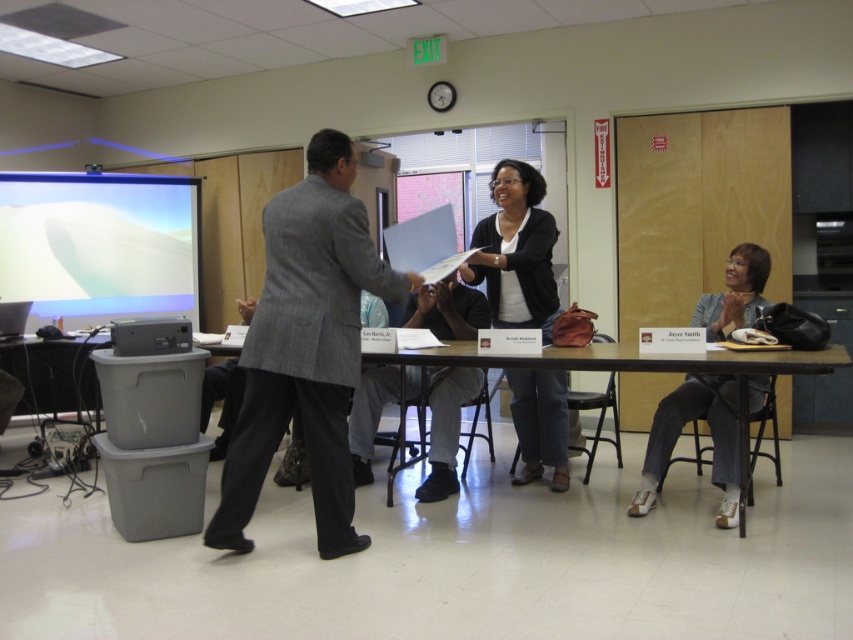
Can you confirm if gray textured suit at center is wider than matte black sweater at center?

Correct, the width of gray textured suit at center exceeds that of matte black sweater at center.

Which is below, gray textured suit at center or matte black sweater at center?

gray textured suit at center is below.

Who is more distant from viewer, [323,333] or [519,474]?

Point [519,474]

The width and height of the screenshot is (853, 640). I want to click on gray textured suit at center, so click(x=306, y=348).

Can you confirm if gray textured suit at center is wider than white matte projection screen at upper left?

Incorrect, gray textured suit at center's width does not surpass white matte projection screen at upper left's.

Is gray textured suit at center bigger than white matte projection screen at upper left?

Actually, gray textured suit at center might be smaller than white matte projection screen at upper left.

Where is `gray textured suit at center`? The image size is (853, 640). gray textured suit at center is located at coordinates (306, 348).

Can you confirm if denim jeans at lower right is positioned to the left of wooden table at center?

No, denim jeans at lower right is not to the left of wooden table at center.

Measure the distance between denim jeans at lower right and wooden table at center.

They are 14.26 inches apart.

Is point (683, 381) behind point (698, 353)?

That is True.

The width and height of the screenshot is (853, 640). In order to click on denim jeans at lower right in this screenshot , I will do pyautogui.click(x=679, y=433).